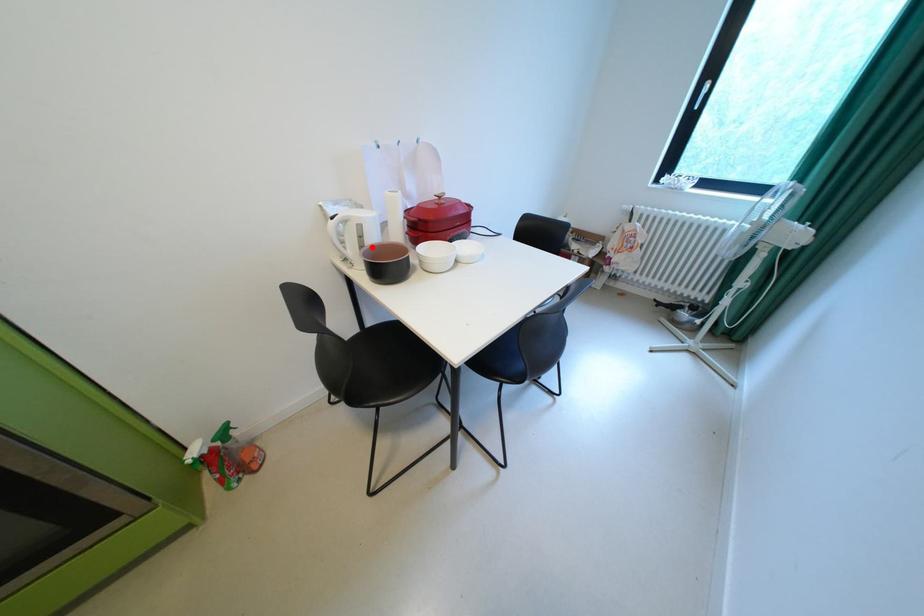
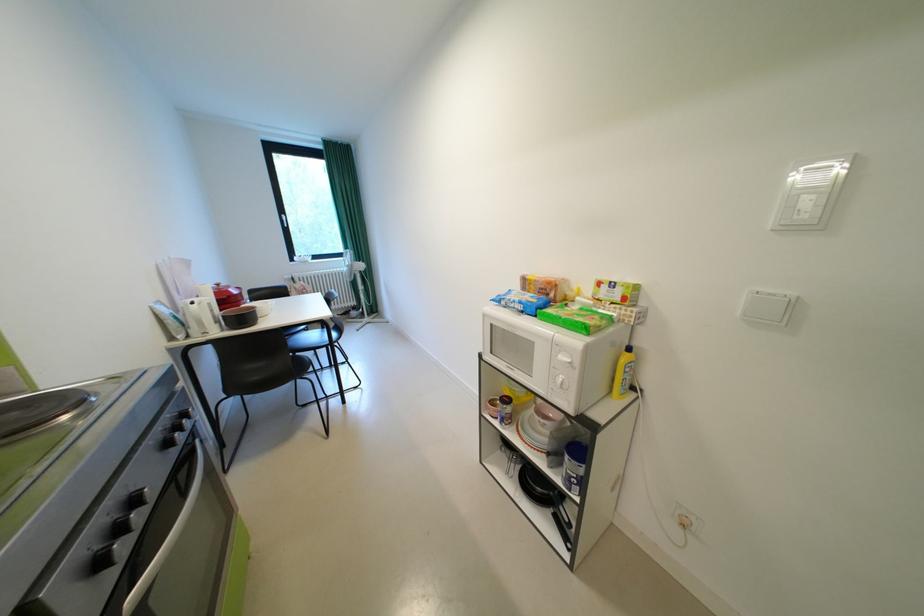
Find the pixel in the second image that matches the highlighted location in the first image.

(225, 317)